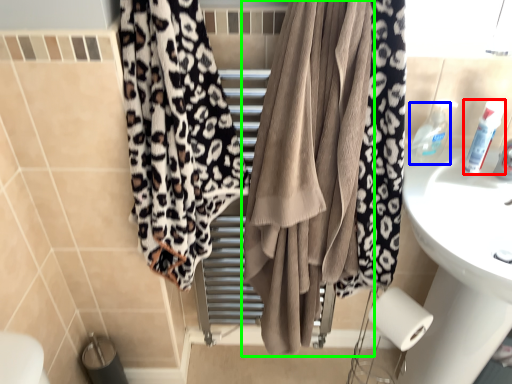
Question: Estimate the real-world distances between objects in this image. Which object is farther from toiletry (highlighted by a red box), toiletry (highlighted by a blue box) or curtain (highlighted by a green box)?

Choices:
 (A) toiletry
 (B) curtain

Answer: (B)